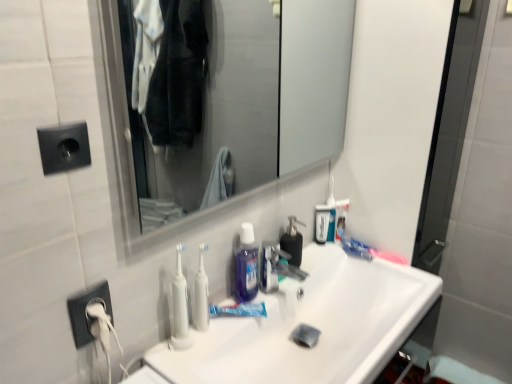
What do you see at coordinates (231, 91) in the screenshot?
I see `clear glass mirror at upper center` at bounding box center [231, 91].

Measure the distance between white glossy sink at center and camera.

The depth of white glossy sink at center is 89.92 centimeters.

In order to face transparent plastic mouthwash at center, placed as the 1th mouthwash when sorted from back to front, should I rotate leftwards or rightwards?

You should rotate right by 8.957 degrees.

Image resolution: width=512 pixels, height=384 pixels. Describe the element at coordinates (86, 312) in the screenshot. I see `black plastic electric outlet at lower left, marked as the 1th electric outlet in a back-to-front arrangement` at that location.

Locate an element on the screen. The width and height of the screenshot is (512, 384). white plastic toothbrush at center, positioned as the 2th toothbrush in right-to-left order is located at coordinates (201, 294).

Is white glossy sink at center closer to camera compared to clear glass mirror at upper center?

No, it is not.

Can you confirm if white glossy sink at center is thinner than clear glass mirror at upper center?

Incorrect, the width of white glossy sink at center is not less than that of clear glass mirror at upper center.

Which is more to the left, white glossy sink at center or clear glass mirror at upper center?

From the viewer's perspective, clear glass mirror at upper center appears more on the left side.

How far apart are white glossy sink at center and clear glass mirror at upper center?

white glossy sink at center is 84.78 centimeters from clear glass mirror at upper center.

Would you consider white glossy sink at center to be distant from pink plastic toothbrush at upper right, acting as the 2th toothbrush starting from the front?

No, white glossy sink at center is in close proximity to pink plastic toothbrush at upper right, acting as the 2th toothbrush starting from the front.

Is white glossy sink at center situated inside pink plastic toothbrush at upper right, arranged as the first toothbrush when viewed from the back, or outside?

white glossy sink at center is spatially situated outside pink plastic toothbrush at upper right, arranged as the first toothbrush when viewed from the back.

Considering the positions of points (188, 352) and (362, 243), is point (188, 352) farther from camera compared to point (362, 243)?

That is False.

From the image's perspective, who appears lower, black matte soap dispenser at center or blue glossy toothpaste at center?

blue glossy toothpaste at center is shown below in the image.

Is black matte soap dispenser at center next to blue glossy toothpaste at center?

No, black matte soap dispenser at center is not touching blue glossy toothpaste at center.

From a real-world perspective, which is physically above, black matte soap dispenser at center or blue glossy toothpaste at center?

black matte soap dispenser at center, from a real-world perspective.

Based on the photo, which object is closer to the camera taking this photo, black matte soap dispenser at center or blue glossy toothpaste at center?

blue glossy toothpaste at center is more forward.

How much distance is there between black plastic socket at upper left, marked as the 1th electric outlet in a top-to-bottom arrangement, and blue translucent liquid at center, the second mouthwash from the left?

A distance of 21.78 inches exists between black plastic socket at upper left, marked as the 1th electric outlet in a top-to-bottom arrangement, and blue translucent liquid at center, the second mouthwash from the left.

Relative to blue translucent liquid at center, the second mouthwash viewed from the front, is black plastic socket at upper left, acting as the first electric outlet starting from the front, in front or behind?

Clearly, black plastic socket at upper left, acting as the first electric outlet starting from the front, is in front of blue translucent liquid at center, the second mouthwash viewed from the front.

Can you tell me how much black plastic socket at upper left, acting as the first electric outlet starting from the front, and blue translucent liquid at center, the second mouthwash from the left, differ in facing direction?

black plastic socket at upper left, acting as the first electric outlet starting from the front, and blue translucent liquid at center, the second mouthwash from the left, are facing 2.45 degrees away from each other.

Does black plastic socket at upper left, marked as the 1th electric outlet in a top-to-bottom arrangement, have a lesser height compared to blue translucent liquid at center, the second mouthwash viewed from the right?

Yes, black plastic socket at upper left, marked as the 1th electric outlet in a top-to-bottom arrangement, is shorter than blue translucent liquid at center, the second mouthwash viewed from the right.

Is point (339, 208) closer to viewer compared to point (289, 250)?

No, it is not.

Is white plastic toothpaste tube at upper right oriented away from black matte soap dispenser at center?

No, white plastic toothpaste tube at upper right is not facing away from black matte soap dispenser at center.

Would you consider white plastic toothpaste tube at upper right to be distant from black matte soap dispenser at center?

No.

Do you think white plastic toothpaste tube at upper right is within black matte soap dispenser at center, or outside of it?

white plastic toothpaste tube at upper right is outside black matte soap dispenser at center.

Considering the sizes of objects transparent plastic mouthwash at center, acting as the first mouthwash starting from the right, and black matte soap dispenser at center in the image provided, who is taller, transparent plastic mouthwash at center, acting as the first mouthwash starting from the right, or black matte soap dispenser at center?

black matte soap dispenser at center.

From a real-world perspective, which is physically above, transparent plastic mouthwash at center, the 3th mouthwash when ordered from left to right, or black matte soap dispenser at center?

black matte soap dispenser at center is physically above.

How different are the orientations of transparent plastic mouthwash at center, placed as the 1th mouthwash when sorted from back to front, and black matte soap dispenser at center in degrees?

20.9 degrees separate the facing orientations of transparent plastic mouthwash at center, placed as the 1th mouthwash when sorted from back to front, and black matte soap dispenser at center.

Does transparent plastic mouthwash at center, the 3th mouthwash when ordered from left to right, have a lesser width compared to black matte soap dispenser at center?

Correct, the width of transparent plastic mouthwash at center, the 3th mouthwash when ordered from left to right, is less than that of black matte soap dispenser at center.

Is white plastic toothbrush at center, the 1th toothbrush when ordered from left to right, not near pink plastic toothbrush at upper right, arranged as the first toothbrush when viewed from the back?

They are positioned close to each other.

Can you confirm if white plastic toothbrush at center, positioned as the 2th toothbrush in right-to-left order, is positioned to the right of pink plastic toothbrush at upper right, acting as the 2th toothbrush starting from the front?

No, white plastic toothbrush at center, positioned as the 2th toothbrush in right-to-left order, is not to the right of pink plastic toothbrush at upper right, acting as the 2th toothbrush starting from the front.

Is white plastic toothbrush at center, the 1th toothbrush when ordered from left to right, shorter than pink plastic toothbrush at upper right, acting as the 2th toothbrush starting from the front?

Incorrect, the height of white plastic toothbrush at center, the 1th toothbrush when ordered from left to right, does not fall short of that of pink plastic toothbrush at upper right, acting as the 2th toothbrush starting from the front.

Identify the location of mirror lying above the white glossy sink at center (from the image's perspective). This screenshot has height=384, width=512. (231, 91).

In the image, there is a pink plastic toothbrush at upper right, which ranks as the second toothbrush in left-to-right order. In order to click on sink below it (from the image's perspective) in this screenshot , I will do `click(309, 324)`.

Estimate the real-world distances between objects in this image. Which object is closer to transparent plastic mouthwash at center, acting as the first mouthwash starting from the right, pink plastic toothbrush at upper right, placed as the 1th toothbrush when sorted from right to left, or translucent purple mouthwash at center, arranged as the third mouthwash when viewed from the right?

Based on the image, pink plastic toothbrush at upper right, placed as the 1th toothbrush when sorted from right to left, appears to be nearer to transparent plastic mouthwash at center, acting as the first mouthwash starting from the right.

From the image, which object appears to be farther from translucent purple mouthwash at center, positioned as the first mouthwash in left-to-right order, blue glossy toothpaste at center or blue translucent liquid at center, the second mouthwash viewed from the front?

The object further to translucent purple mouthwash at center, positioned as the first mouthwash in left-to-right order, is blue translucent liquid at center, the second mouthwash viewed from the front.

When comparing their distances from translucent purple mouthwash at center, which appears as the third mouthwash when viewed from the back, does white glossy sink at center or blue glossy toothpaste at center seem closer?

blue glossy toothpaste at center.

Based on their spatial positions, is white plastic toothpaste tube at upper right or white plastic toothbrush at center, the first toothbrush viewed from the front, further from clear glass mirror at upper center?

white plastic toothbrush at center, the first toothbrush viewed from the front, lies further to clear glass mirror at upper center than the other object.

Considering their positions, is blue translucent liquid at center, the second mouthwash viewed from the right, positioned closer to translucent purple mouthwash at center, positioned as the first mouthwash in left-to-right order, than pink plastic toothbrush at upper right, acting as the 2th toothbrush starting from the front?

blue translucent liquid at center, the second mouthwash viewed from the right, is closer to translucent purple mouthwash at center, positioned as the first mouthwash in left-to-right order.

From the image, which object appears to be nearer to white plastic toothpaste tube at upper right, blue translucent liquid at center, the second mouthwash from the left, or transparent plastic mouthwash at center, the 3th mouthwash when ordered from left to right?

transparent plastic mouthwash at center, the 3th mouthwash when ordered from left to right, lies closer to white plastic toothpaste tube at upper right than the other object.

Which object lies nearer to the anchor point clear glass mirror at upper center, white glossy sink at center or white plastic toothpaste tube at upper right?

white glossy sink at center lies closer to clear glass mirror at upper center than the other object.

Which object lies further to the anchor point white plastic toothpaste tube at upper right, translucent purple mouthwash at center, which appears as the third mouthwash when viewed from the back, or black plastic electric outlet at lower left, marked as the 1th electric outlet in a back-to-front arrangement?

The object further to white plastic toothpaste tube at upper right is black plastic electric outlet at lower left, marked as the 1th electric outlet in a back-to-front arrangement.

I want to click on toothbrush between translucent purple mouthwash at center, arranged as the third mouthwash when viewed from the right, and blue glossy toothpaste at center from front to back, so click(x=201, y=294).

Where is `mouthwash between translucent purple mouthwash at center, arranged as the third mouthwash when viewed from the right, and transparent plastic mouthwash at center, acting as the first mouthwash starting from the right, along the z-axis`? The image size is (512, 384). mouthwash between translucent purple mouthwash at center, arranged as the third mouthwash when viewed from the right, and transparent plastic mouthwash at center, acting as the first mouthwash starting from the right, along the z-axis is located at coordinates (246, 264).

Find the location of `mouthwash between blue glossy toothpaste at center and white plastic toothpaste tube at upper right along the z-axis`. mouthwash between blue glossy toothpaste at center and white plastic toothpaste tube at upper right along the z-axis is located at coordinates (322, 223).

Where is `soap dispenser located between blue glossy toothpaste at center and pink plastic toothbrush at upper right, acting as the 2th toothbrush starting from the front, in the left-right direction`? The width and height of the screenshot is (512, 384). soap dispenser located between blue glossy toothpaste at center and pink plastic toothbrush at upper right, acting as the 2th toothbrush starting from the front, in the left-right direction is located at coordinates (293, 241).